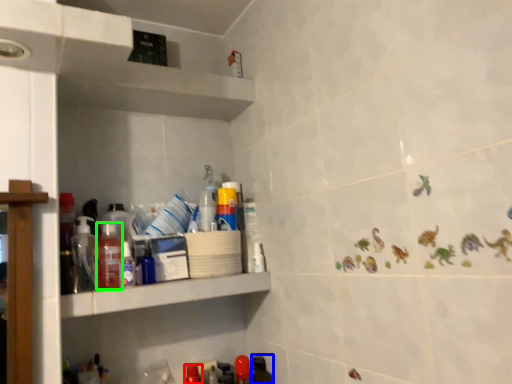
Question: Which object is positioned farthest from bottle (highlighted by a red box)? Select from bottle (highlighted by a blue box) and bottle (highlighted by a green box).

Choices:
 (A) bottle
 (B) bottle

Answer: (B)